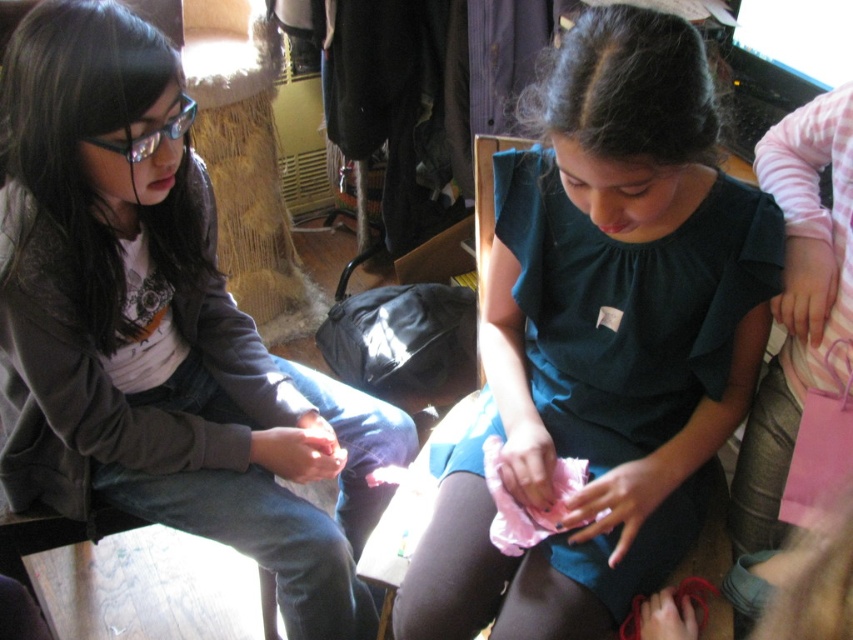
Describe the element at coordinates (602, 339) in the screenshot. This screenshot has height=640, width=853. I see `dark green fabric dress at center` at that location.

Which of these two, dark green fabric dress at center or matte black jacket at left, stands shorter?

dark green fabric dress at center is shorter.

Between point (544, 189) and point (177, 205), which one is positioned in front?

Point (544, 189) is more forward.

Where is `dark green fabric dress at center`? The height and width of the screenshot is (640, 853). dark green fabric dress at center is located at coordinates (602, 339).